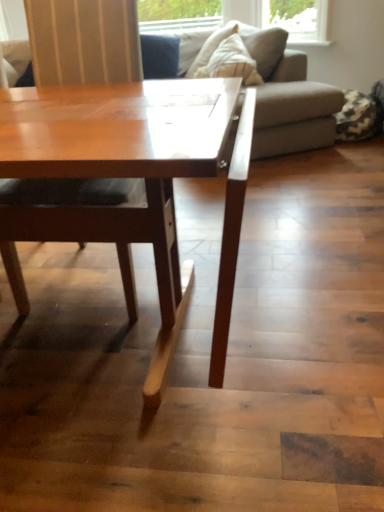
The image size is (384, 512). I want to click on free space in front of matte wood chair at center, so click(x=96, y=361).